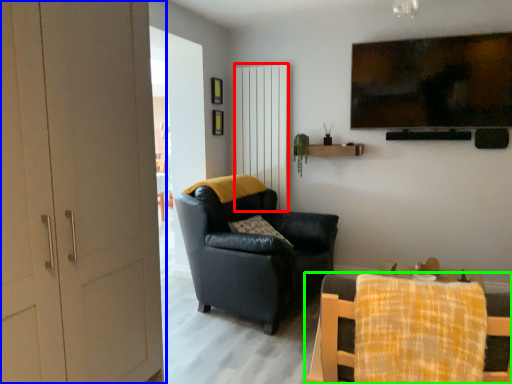
Question: Which object is positioned farthest from curtain (highlighted by a red box)? Select from door (highlighted by a blue box) and chair (highlighted by a green box).

Choices:
 (A) door
 (B) chair

Answer: (B)